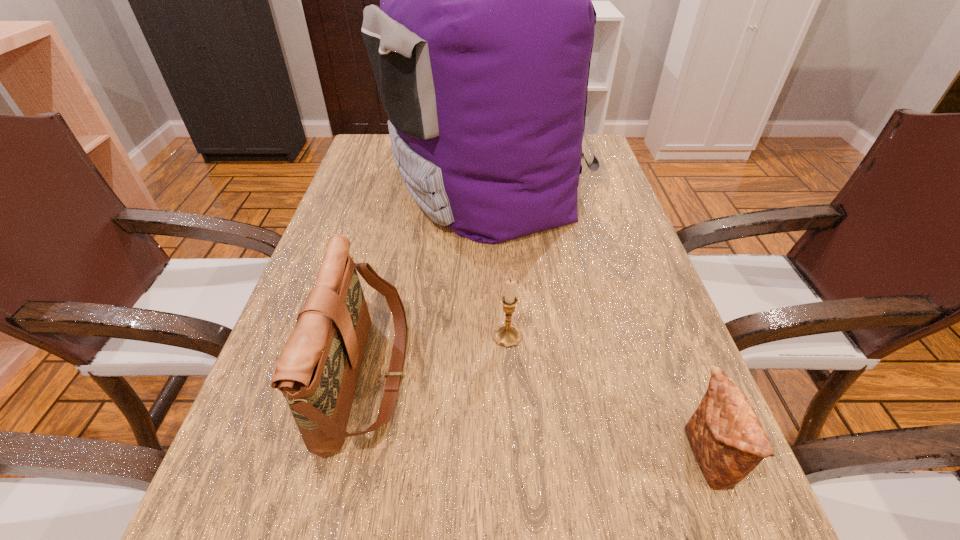
Identify the location of vacant space that's between the candle holder and the farthest object. The height and width of the screenshot is (540, 960). tap(496, 260).

Find the location of a particular element. vacant point located between the clutch bag and the second tallest object is located at coordinates (537, 417).

This screenshot has height=540, width=960. What are the coordinates of `unoccupied position between the tallest object and the candle holder` in the screenshot? It's located at (496, 260).

Where is `free space between the candle holder and the rightmost object`? free space between the candle holder and the rightmost object is located at coordinates (607, 397).

Where is `vacant space in between the farthest object and the shoulder bag`? The height and width of the screenshot is (540, 960). vacant space in between the farthest object and the shoulder bag is located at coordinates (426, 280).

Locate an element on the screen. unoccupied area between the rightmost object and the tallest object is located at coordinates [x=596, y=321].

Where is `free area in between the candle holder and the farthest object`? Image resolution: width=960 pixels, height=540 pixels. free area in between the candle holder and the farthest object is located at coordinates (496, 260).

Identify the location of free space between the shoulder bag and the tallest object. This screenshot has height=540, width=960. (426, 280).

This screenshot has width=960, height=540. Identify the location of vacant space that is in between the rightmost object and the farthest object. (596, 321).

Locate an element on the screen. free space between the backpack and the rightmost object is located at coordinates (596, 321).